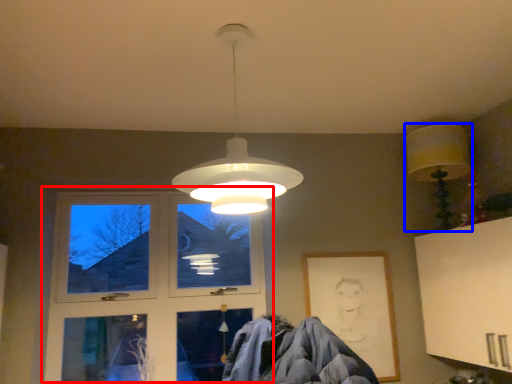
Question: Among these objects, which one is farthest to the camera, window (highlighted by a red box) or lamp (highlighted by a blue box)?

Choices:
 (A) window
 (B) lamp

Answer: (A)